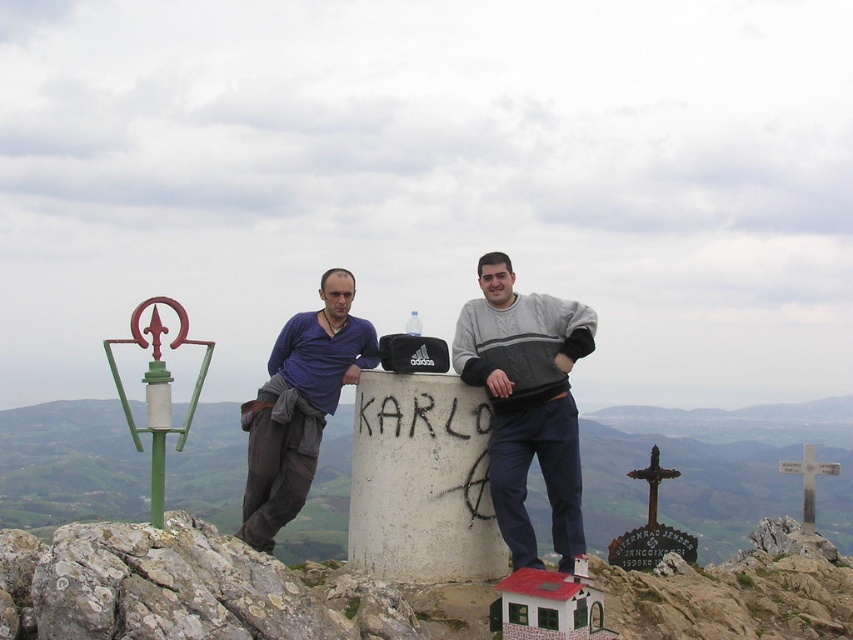
You are planning to place a new sign on the white concrete cylinder at center. To ensure it doesn not block the view of the blue cotton shirt at center, where should you position the sign?

The white concrete cylinder at center is located below the blue cotton shirt at center, so placing the sign on the top of the white concrete cylinder at center would keep it from blocking the view of the blue cotton shirt at center.

You are a hiker who wants to place a 13.5 meter long tent between the white concrete cylinder at center and the gray sweater at center. Can you fit the tent between them without overlapping either object?

The distance between the white concrete cylinder at center and the gray sweater at center is 12.95 meters, which is shorter than the 13.5 meter long tent. Therefore, the tent cannot be placed between them without overlapping one of the objects.